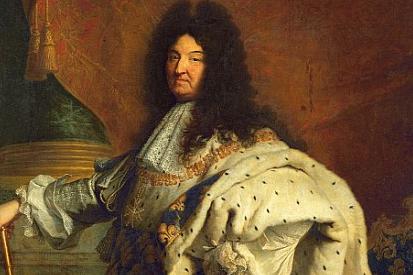
Where is `tassles`? Image resolution: width=413 pixels, height=275 pixels. tassles is located at coordinates (49, 47), (32, 48).